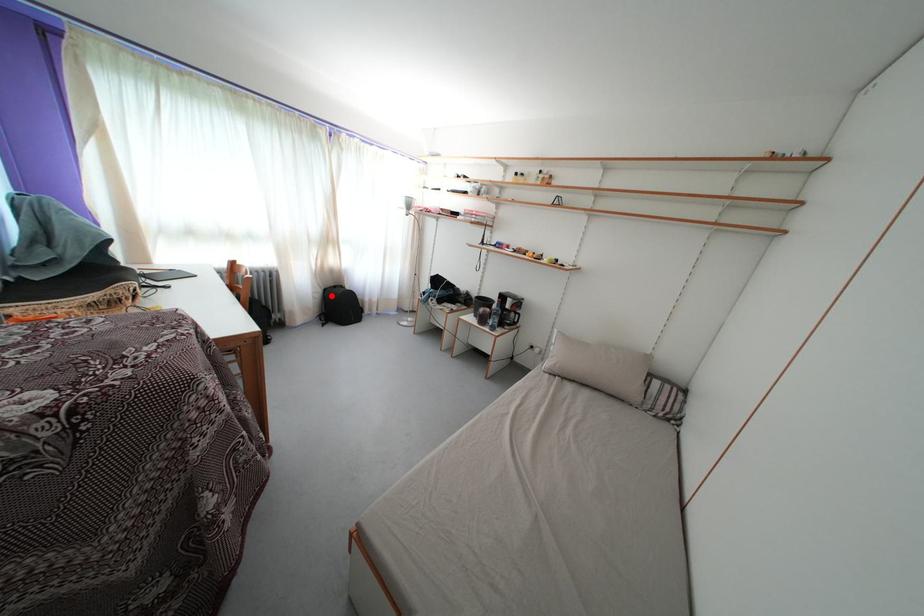
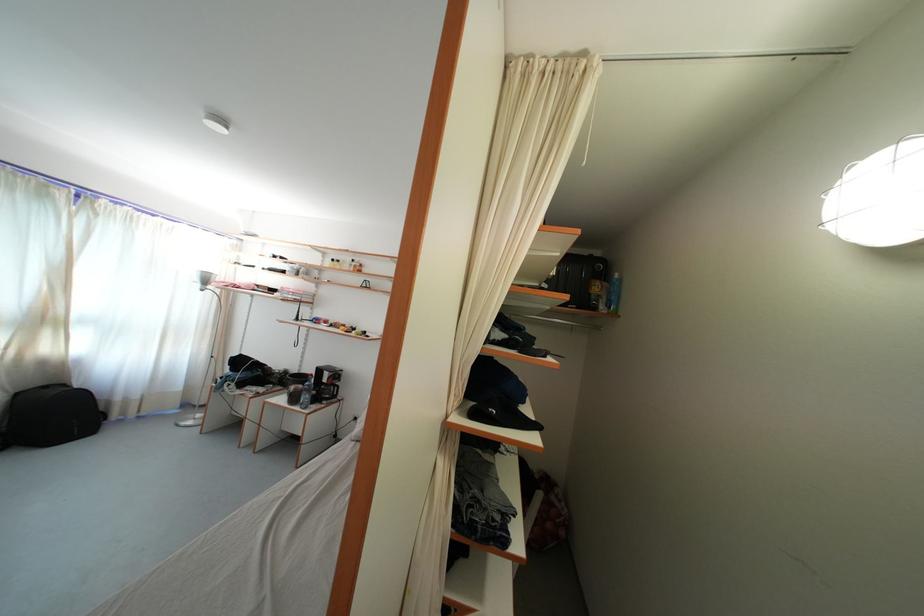
The point at the highlighted location is marked in the first image. Where is the corresponding point in the second image?

(23, 400)